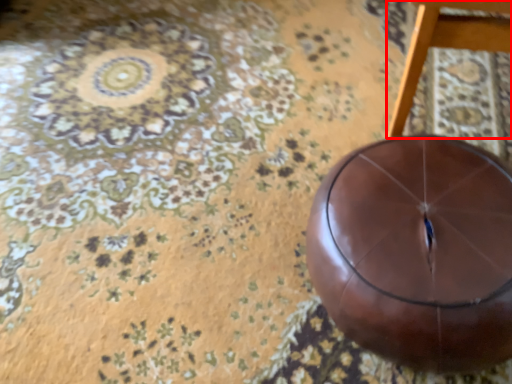
Question: Considering the relative positions of furniture (annotated by the red box) and ball in the image provided, where is furniture (annotated by the red box) located with respect to the staircase?

Choices:
 (A) left
 (B) right

Answer: (B)